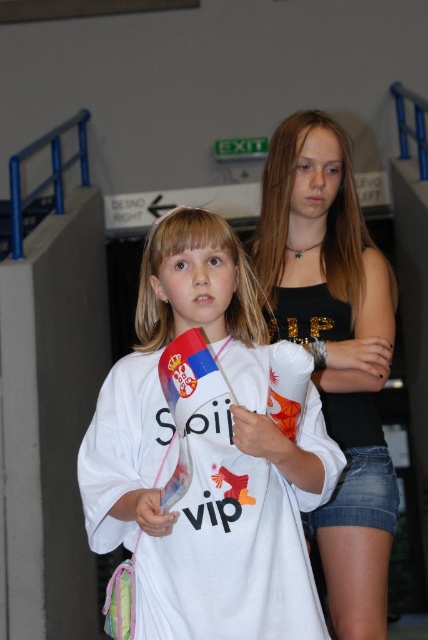
Does white cotton shirt at center have a smaller size compared to black matte tank top at center?

No.

Describe the element at coordinates (207, 458) in the screenshot. I see `white cotton shirt at center` at that location.

Describe the element at coordinates (207, 458) in the screenshot. The image size is (428, 640). I see `white cotton shirt at center` at that location.

Where is `white cotton shirt at center`? white cotton shirt at center is located at coordinates (207, 458).